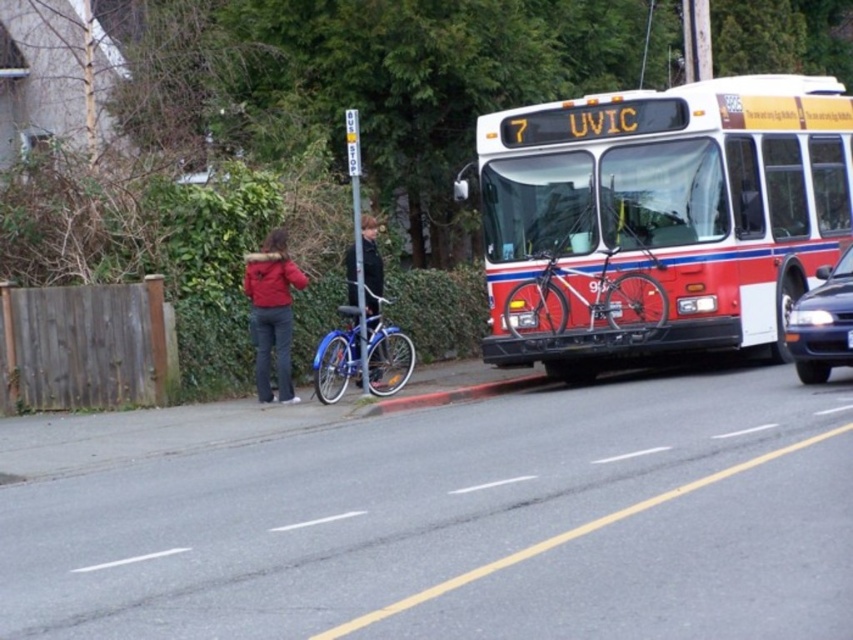
You are a delivery person who needs to move a 3.5 meter long ladder from the blue metallic bicycle at center to the shiny black sedan at right. Is there enough space between them to carry the ladder horizontally without tilting it?

The blue metallic bicycle at center and shiny black sedan at right are 5.76 meters apart from each other. Since the ladder is 3.5 meters long, there is sufficient space to carry it horizontally between them without tilting.

You are a pedestrian standing at the bus stop and want to board the red matte bus at upper right. Based on the scene description, can you confirm the bus is heading towards the University of Victoria?

The red matte bus at upper right has a destination sign reading 7 UVIC, indicating it is heading towards the University of Victoria.

You are a delivery person who needs to load a package onto a delivery truck parked behind the shiny black sedan at right. The blue metallic bicycle at center is blocking the truck. Can you move the bicycle to access the truck?

The blue metallic bicycle at center is not as tall as the shiny black sedan at right, so it can be moved to allow access to the truck parked behind the sedan.